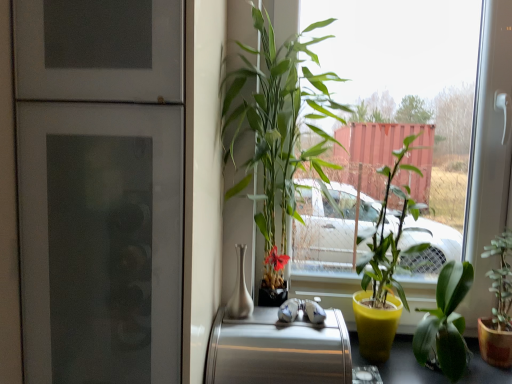
Find the location of `vacant region above brushed metal toaster at center (from a real-world perspective)`. vacant region above brushed metal toaster at center (from a real-world perspective) is located at coordinates (298, 318).